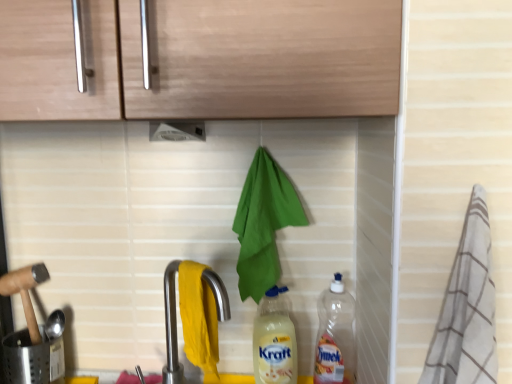
Question: Should I look upward or downward to see white plastic exhaust hood at upper center?

Choices:
 (A) up
 (B) down

Answer: (A)

Question: Is satin nickel faucet at lower center positioned behind matte plastic bottle at center, which is the 1th bottle from left to right?

Choices:
 (A) yes
 (B) no

Answer: (B)

Question: Does satin nickel faucet at lower center have a greater height compared to matte plastic bottle at center, the second bottle in the right-to-left sequence?

Choices:
 (A) no
 (B) yes

Answer: (A)

Question: Considering the relative sizes of satin nickel faucet at lower center and matte plastic bottle at center, the second bottle in the right-to-left sequence, in the image provided, is satin nickel faucet at lower center shorter than matte plastic bottle at center, the second bottle in the right-to-left sequence,?

Choices:
 (A) yes
 (B) no

Answer: (A)

Question: From the image's perspective, is satin nickel faucet at lower center located beneath matte plastic bottle at center, the second bottle in the right-to-left sequence?

Choices:
 (A) no
 (B) yes

Answer: (A)

Question: Is satin nickel faucet at lower center turned away from matte plastic bottle at center, which is the 1th bottle from left to right?

Choices:
 (A) yes
 (B) no

Answer: (A)

Question: Considering the relative sizes of satin nickel faucet at lower center and matte plastic bottle at center, the second bottle in the right-to-left sequence, in the image provided, is satin nickel faucet at lower center bigger than matte plastic bottle at center, the second bottle in the right-to-left sequence,?

Choices:
 (A) yes
 (B) no

Answer: (B)

Question: Is transparent plastic bottle at lower right, the 2th bottle when ordered from left to right, not inside white plastic exhaust hood at upper center?

Choices:
 (A) yes
 (B) no

Answer: (A)

Question: Can you confirm if transparent plastic bottle at lower right, placed as the first bottle when sorted from right to left, is taller than white plastic exhaust hood at upper center?

Choices:
 (A) no
 (B) yes

Answer: (B)

Question: Is there a large distance between transparent plastic bottle at lower right, placed as the first bottle when sorted from right to left, and white plastic exhaust hood at upper center?

Choices:
 (A) no
 (B) yes

Answer: (A)

Question: Is transparent plastic bottle at lower right, the 2th bottle when ordered from left to right, thinner than white plastic exhaust hood at upper center?

Choices:
 (A) yes
 (B) no

Answer: (A)

Question: Can you confirm if transparent plastic bottle at lower right, the 2th bottle when ordered from left to right, is wider than white plastic exhaust hood at upper center?

Choices:
 (A) no
 (B) yes

Answer: (A)

Question: Is transparent plastic bottle at lower right, the 2th bottle when ordered from left to right, oriented towards white plastic exhaust hood at upper center?

Choices:
 (A) no
 (B) yes

Answer: (A)

Question: Is white plastic exhaust hood at upper center oriented away from satin nickel faucet at lower center?

Choices:
 (A) no
 (B) yes

Answer: (A)